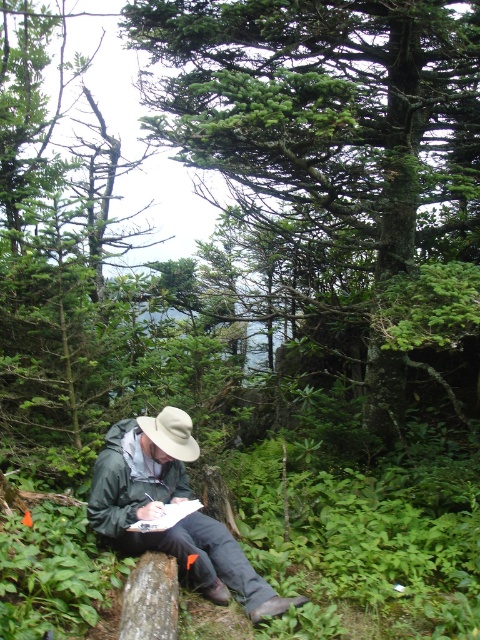
You are standing at the point marked as point (172, 502) in the forest scene. What object is located exactly at that point?

The green matte jacket at center is located exactly at point (172, 502).

Looking at this image, you are a hiker who wants to stay dry during a sudden rain shower. You notice the green leafy tree at center and the green matte jacket at center. Which object can provide shelter from the rain?

The green leafy tree at center is positioned over the green matte jacket at center, so the tree can provide shelter from the rain.